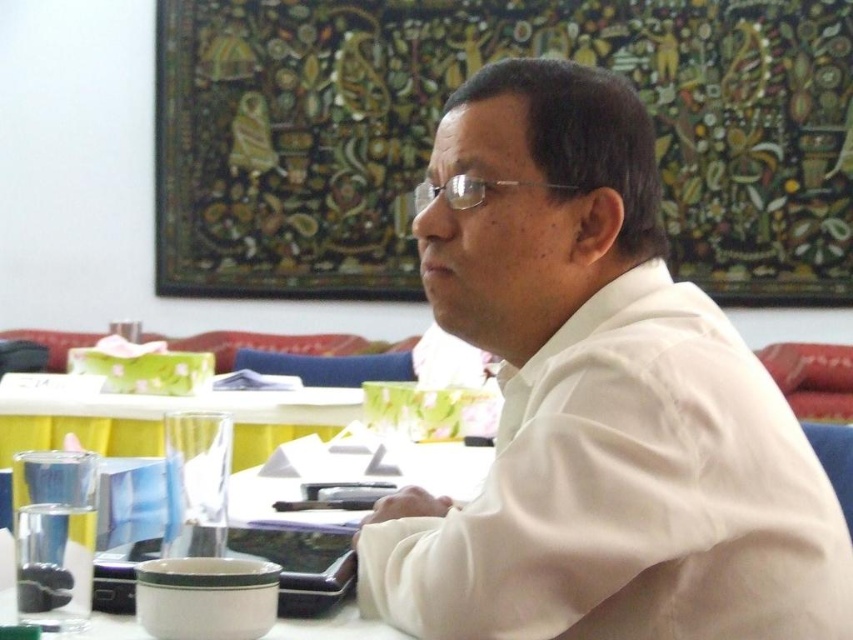
Is white smooth shirt at center below clear plastic glasses at center?

Yes, white smooth shirt at center is below clear plastic glasses at center.

Locate an element on the screen. white smooth shirt at center is located at coordinates (598, 406).

I want to click on white smooth shirt at center, so click(x=598, y=406).